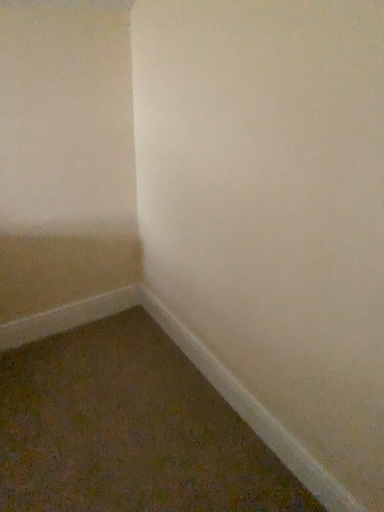
What is the approximate height of white smooth baseboard at lower right?

white smooth baseboard at lower right is 4.74 inches tall.

Where is `white smooth baseboard at lower right`? The height and width of the screenshot is (512, 384). white smooth baseboard at lower right is located at coordinates (198, 369).

What do you see at coordinates (198, 369) in the screenshot?
I see `white smooth baseboard at lower right` at bounding box center [198, 369].

Identify the location of white smooth baseboard at lower right. The height and width of the screenshot is (512, 384). (198, 369).